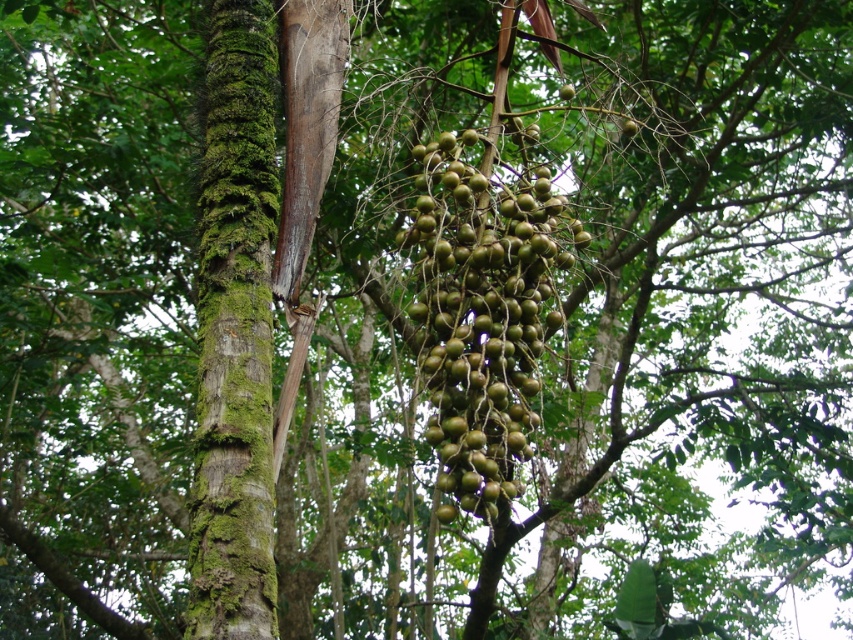
Question: Is green mossy bark at center in front of green matte cluster at center?

Choices:
 (A) yes
 (B) no

Answer: (A)

Question: In this image, where is green mossy bark at center located relative to green matte cluster at center?

Choices:
 (A) above
 (B) below

Answer: (A)

Question: Is green mossy bark at center smaller than green matte cluster at center?

Choices:
 (A) no
 (B) yes

Answer: (A)